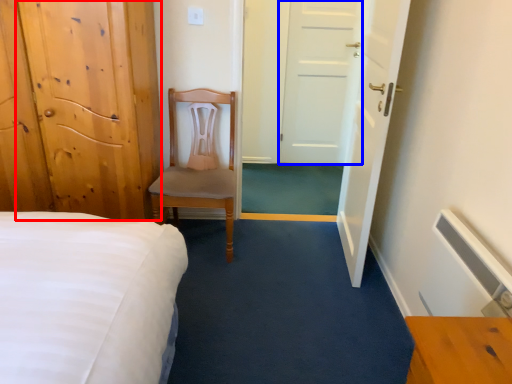
Question: Which of the following is the closest to the observer, door (highlighted by a red box) or door (highlighted by a blue box)?

Choices:
 (A) door
 (B) door

Answer: (A)